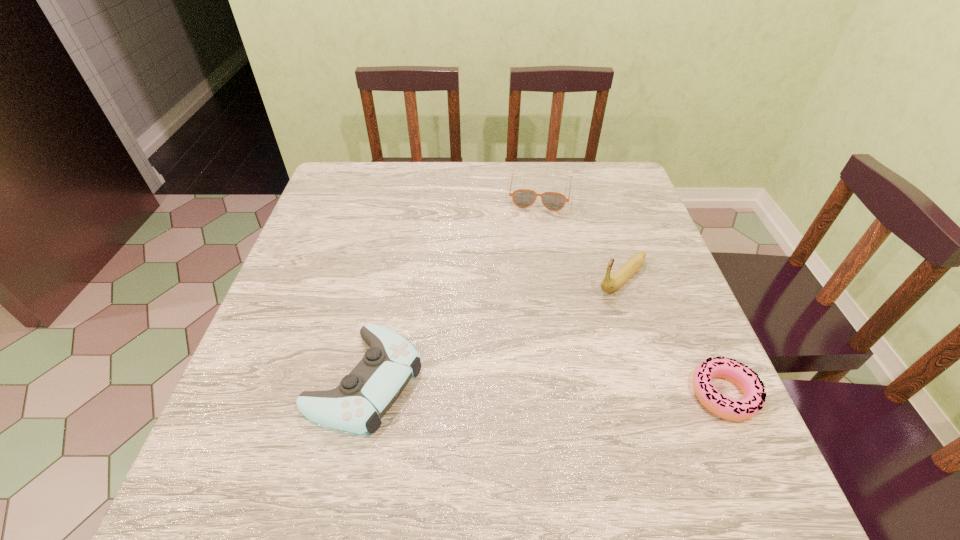
Identify the location of the leftmost object. This screenshot has height=540, width=960. (356, 405).

The width and height of the screenshot is (960, 540). Find the location of `the shortest object`. the shortest object is located at coordinates (745, 378).

Image resolution: width=960 pixels, height=540 pixels. What are the coordinates of `sunglasses` in the screenshot? It's located at (523, 198).

You are a GUI agent. You are given a task and a screenshot of the screen. Output one action in this format:
    pyautogui.click(x=<x>, y=<y>)
    Task: Click on the banana
    The image size is (960, 540).
    Given the screenshot: What is the action you would take?
    pyautogui.click(x=609, y=284)

Where is `the tallest object`? The width and height of the screenshot is (960, 540). the tallest object is located at coordinates (609, 284).

Where is `blank area located on the back of the control`? The width and height of the screenshot is (960, 540). blank area located on the back of the control is located at coordinates (382, 300).

Locate an element on the screen. Image resolution: width=960 pixels, height=540 pixels. vacant space located 0.330m on the back of the shortest object is located at coordinates (662, 253).

Find the location of `vacant area located on the front-facing side of the sunglasses`. vacant area located on the front-facing side of the sunglasses is located at coordinates (529, 273).

Image resolution: width=960 pixels, height=540 pixels. I want to click on free space located on the front-facing side of the sunglasses, so click(x=525, y=304).

Where is `blank area located 0.280m on the front-facing side of the sunglasses`? The width and height of the screenshot is (960, 540). blank area located 0.280m on the front-facing side of the sunglasses is located at coordinates (527, 285).